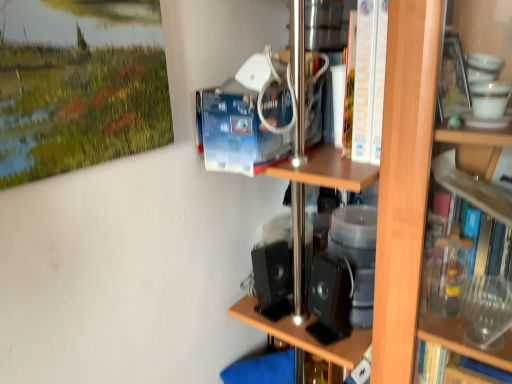
In order to face blue cardboard box at upper center, should I rotate leftwards or rightwards?

To face it directly, rotate right by 1.020 degrees.

Find the location of a particular element. Image resolution: width=512 pixels, height=384 pixels. blue cardboard box at upper center is located at coordinates click(236, 132).

This screenshot has width=512, height=384. What do you see at coordinates (236, 132) in the screenshot?
I see `blue cardboard box at upper center` at bounding box center [236, 132].

In order to click on blue cardboard box at upper center in this screenshot , I will do `click(236, 132)`.